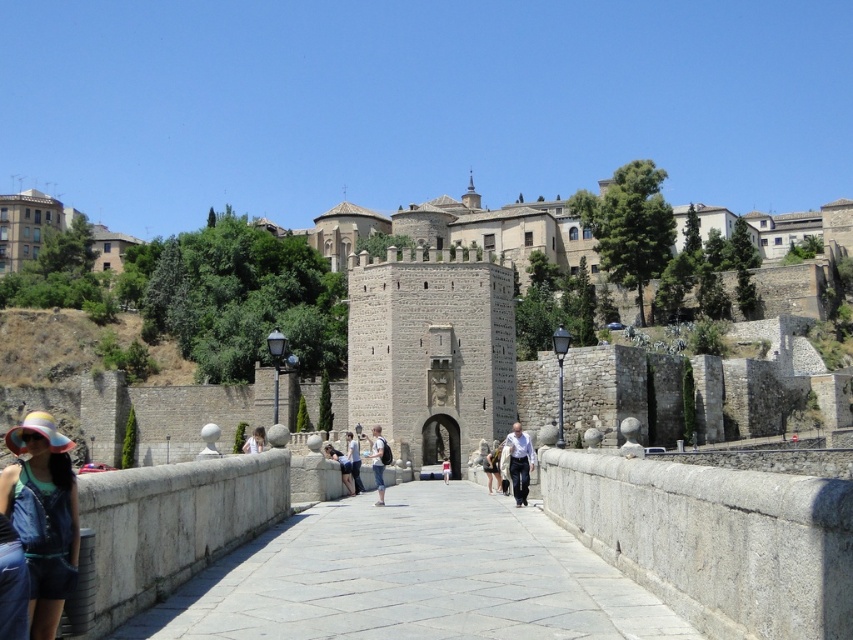
You are a fashion designer observing two denim garments on a mannequin positioned at the center of a historic stone bridge. The garments are light blue denim jeans at center and denim shorts at center. Which garment reaches a lower point on the mannequin?

The denim shorts at center reach a lower point on the mannequin because the light blue denim jeans at center is taller than denim shorts at center, meaning the shorts are shorter in length.

You are standing on the historic stone bridge and want to walk towards the fortified gate. You notice two points marked on the bridge surface, point (625, 579) and point (445, 483). Which point is closer to you as you face the direction of the gate?

Point (625, 579) is closer to the camera than point (445, 483), so as you face the direction of the gate, point (625, 579) is closer to you.